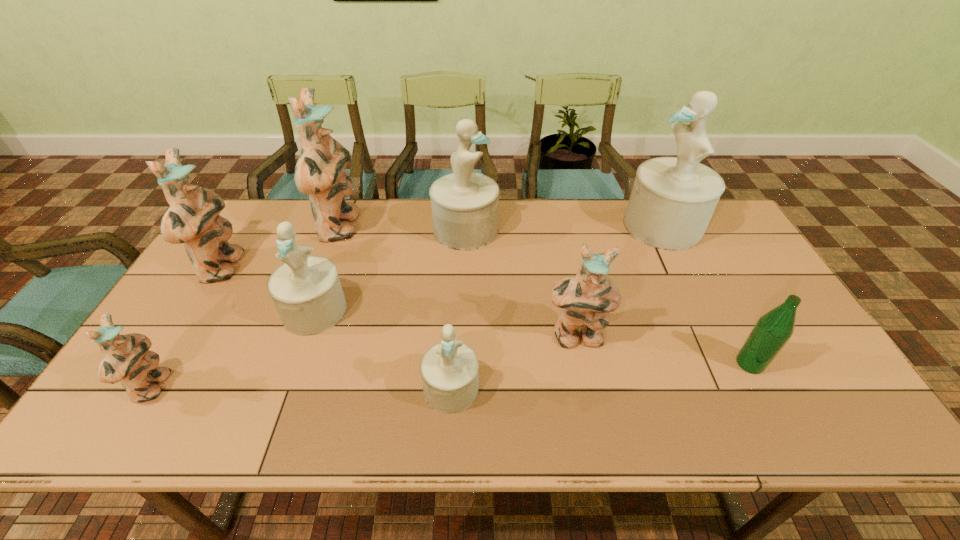
Where is `vacant space in between the leftmost white figurine and the green bottle`? The height and width of the screenshot is (540, 960). vacant space in between the leftmost white figurine and the green bottle is located at coordinates (532, 337).

The height and width of the screenshot is (540, 960). Find the location of `free space between the bottle and the rightmost figurine`. free space between the bottle and the rightmost figurine is located at coordinates (707, 294).

Where is `free space between the bottle and the third smallest pink figurine`? free space between the bottle and the third smallest pink figurine is located at coordinates (486, 316).

Where is `vacant area between the leftmost white figurine and the second figurine from right to left`? The height and width of the screenshot is (540, 960). vacant area between the leftmost white figurine and the second figurine from right to left is located at coordinates (445, 324).

Identify the location of free space between the third smallest pink figurine and the smallest pink figurine. (187, 328).

This screenshot has width=960, height=540. Identify the location of empty location between the rightmost white figurine and the seventh figurine from left to right. (619, 281).

The width and height of the screenshot is (960, 540). I want to click on free space between the green bottle and the smallest white figurine, so click(600, 376).

Locate an element on the screen. vacant area that lies between the second nearest white figurine and the third smallest white figurine is located at coordinates (390, 270).

Locate which object ranks sixth in proximity to the second biggest white figurine. Please provide its 2D coordinates. Your answer should be formatted as a tuple, i.e. [(x, y)], where the tuple contains the x and y coordinates of a point satisfying the conditions above.

[(192, 218)]

Where is `object that ranks as the closest to the green bottle`? The height and width of the screenshot is (540, 960). object that ranks as the closest to the green bottle is located at coordinates (586, 299).